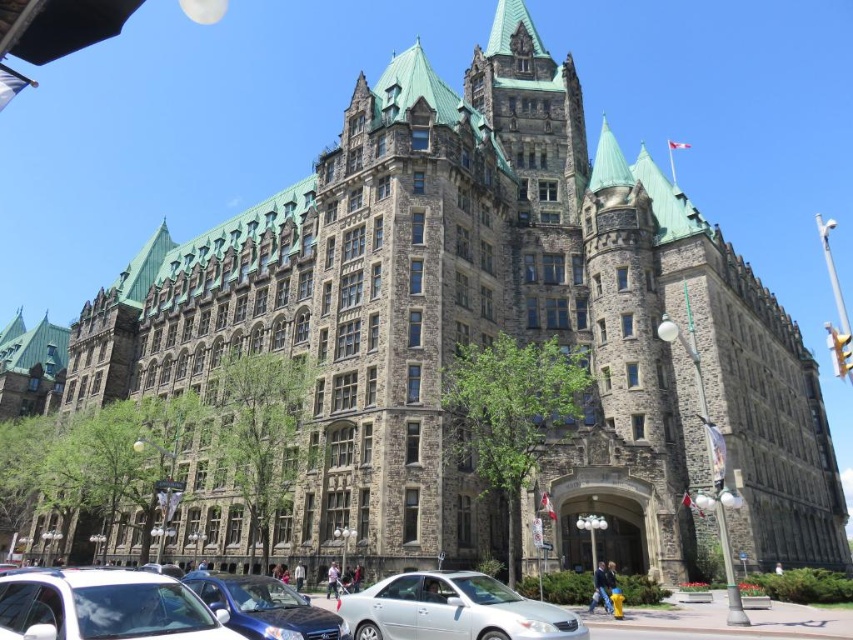
Between silver metallic sedan at center and metallic blue sedan at center, which one appears on the left side from the viewer's perspective?

metallic blue sedan at center

Is point (552, 618) positioned before point (276, 596)?

Yes, it is in front of point (276, 596).

Is point (456, 589) more distant than point (311, 636)?

That is True.

At what (x,y) coordinates should I click in order to perform the action: click on silver metallic sedan at center. Please return your answer as a coordinate pair (x, y). The width and height of the screenshot is (853, 640). Looking at the image, I should click on 451,609.

Can you confirm if white glossy sedan at lower left is bigger than silver metallic sedan at center?

No, white glossy sedan at lower left is not bigger than silver metallic sedan at center.

Looking at this image, who is more distant from viewer, [136,589] or [546,608]?

The point [546,608] is more distant.

Who is more forward, (134, 636) or (415, 596)?

Point (134, 636) is more forward.

At what (x,y) coordinates should I click in order to perform the action: click on white glossy sedan at lower left. Please return your answer as a coordinate pair (x, y). Looking at the image, I should click on (103, 605).

Is white glossy sedan at lower left below metallic blue sedan at center?

No.

This screenshot has width=853, height=640. Describe the element at coordinates (103, 605) in the screenshot. I see `white glossy sedan at lower left` at that location.

Where is `white glossy sedan at lower left`? white glossy sedan at lower left is located at coordinates (103, 605).